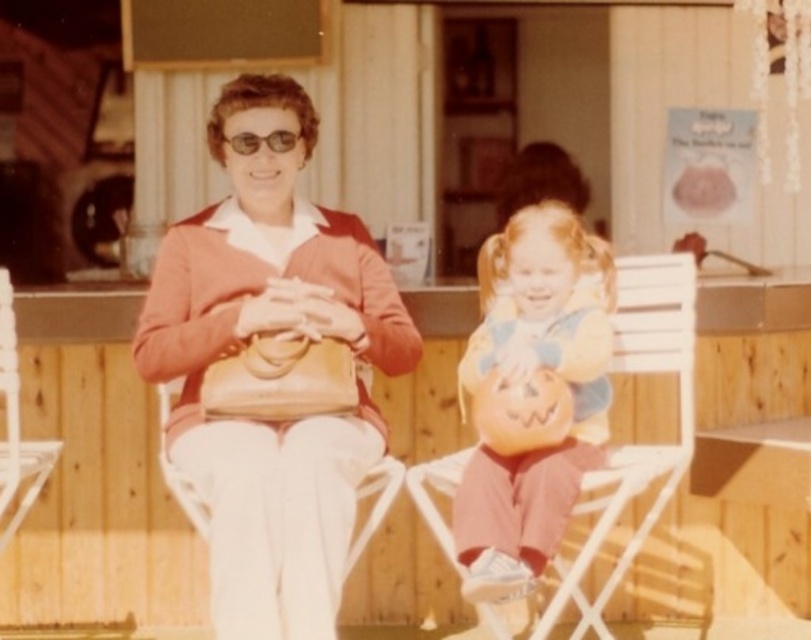
Question: Is matte pumpkin at center further to camera compared to white plastic folding chair at lower left?

Choices:
 (A) no
 (B) yes

Answer: (A)

Question: Which object appears farthest from the camera in this image?

Choices:
 (A) matte pumpkin at center
 (B) matte brown purse at center
 (C) white plastic chair at center

Answer: (C)

Question: Which object is the closest to the matte brown purse at center?

Choices:
 (A) white plastic folding chair at lower left
 (B) matte pumpkin at center
 (C) white plastic chair at center

Answer: (B)

Question: Does matte brown purse at center have a smaller size compared to white plastic folding chair at lower left?

Choices:
 (A) yes
 (B) no

Answer: (B)

Question: Which of the following is the farthest from the observer?

Choices:
 (A) (496, 620)
 (B) (573, 337)
 (C) (280, 588)
 (D) (15, 413)

Answer: (D)

Question: Does matte pumpkin at center appear on the left side of white plastic folding chair at lower left?

Choices:
 (A) yes
 (B) no

Answer: (B)